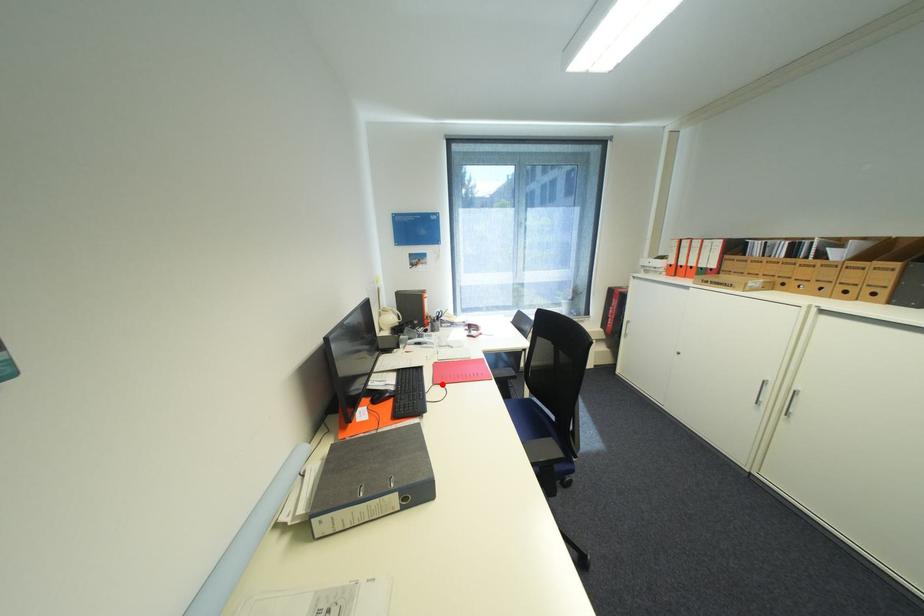
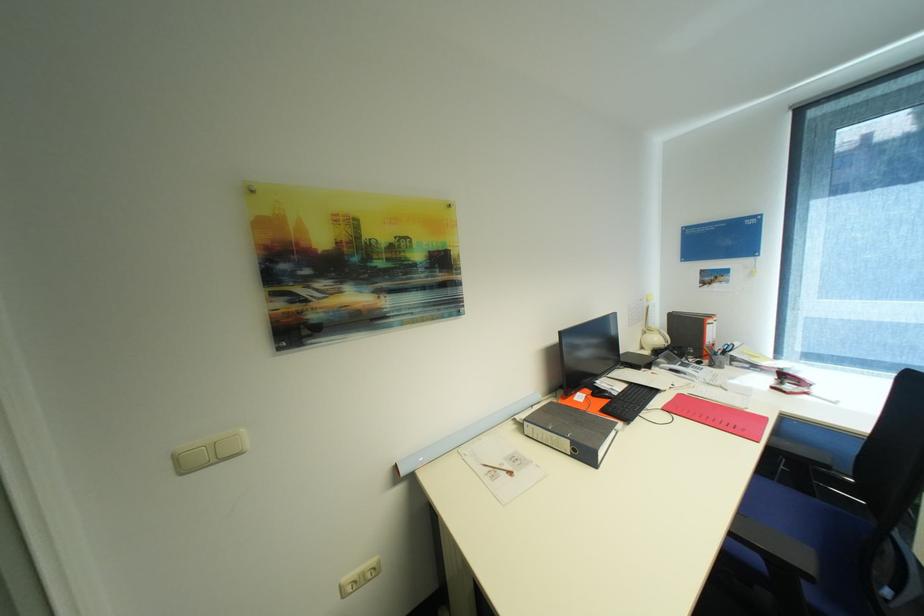
Locate, in the second image, the point that corresponds to the highlighted location in the first image.

(671, 410)